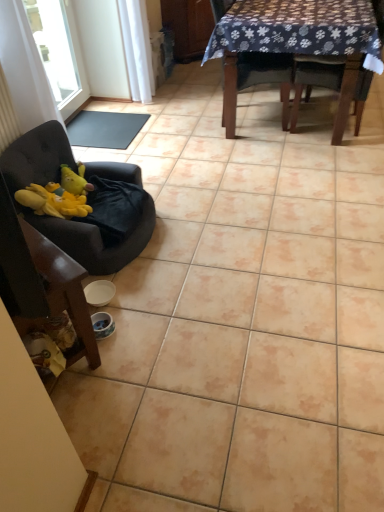
Question: Would you say yellow plush at left is inside or outside dark fabric chair at upper right, arranged as the fourth chair when viewed from the left?

Choices:
 (A) inside
 (B) outside

Answer: (B)

Question: Considering the positions of yellow plush at left and dark fabric chair at upper right, the 1th chair in the right-to-left sequence, in the image, is yellow plush at left taller or shorter than dark fabric chair at upper right, the 1th chair in the right-to-left sequence,?

Choices:
 (A) short
 (B) tall

Answer: (A)

Question: Which is nearer to the velvet dark brown armchair at left, placed as the first chair when sorted from left to right?

Choices:
 (A) dark fabric chair at upper right, arranged as the fourth chair when viewed from the left
 (B) yellow plush at left
 (C) velvet dark gray chair at left, which is the 2th chair from left to right
 (D) black rubber mat at center
 (E) wooden chair at upper right, the second chair from the right

Answer: (C)

Question: Estimate the real-world distances between objects in this image. Which object is farther from the dark fabric chair at upper right, the 1th chair in the right-to-left sequence?

Choices:
 (A) wooden table at upper center
 (B) velvet dark brown armchair at left, placed as the first chair when sorted from left to right
 (C) yellow plush at left
 (D) transparent glass window at upper left
 (E) velvet dark gray chair at left, arranged as the third chair when viewed from the right

Answer: (B)